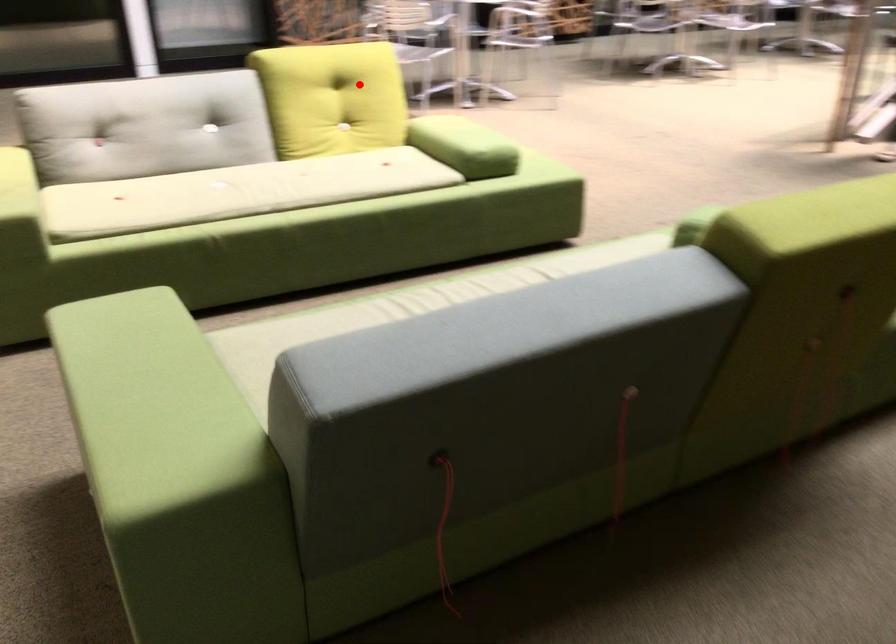
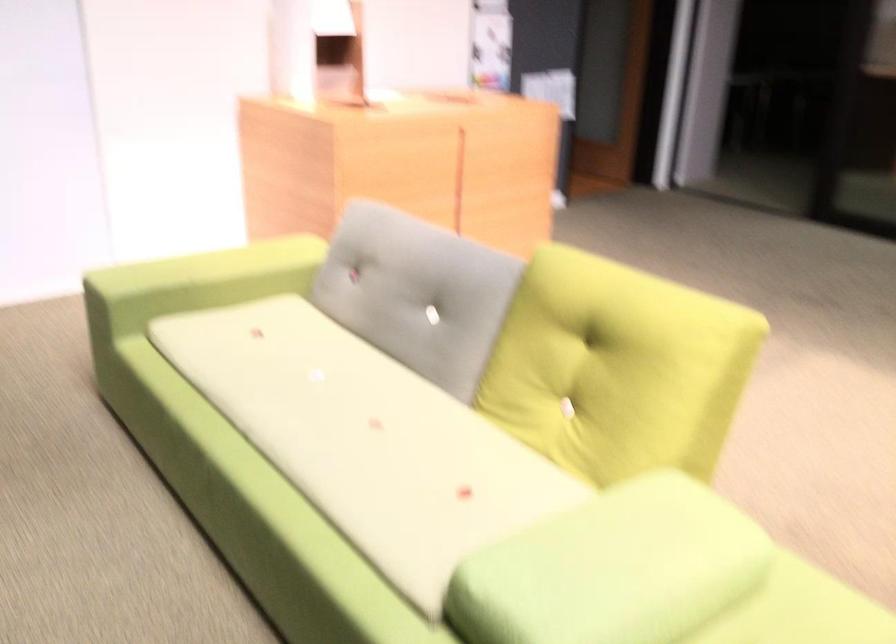
The point at the highlighted location is marked in the first image. Where is the corresponding point in the second image?

(616, 368)